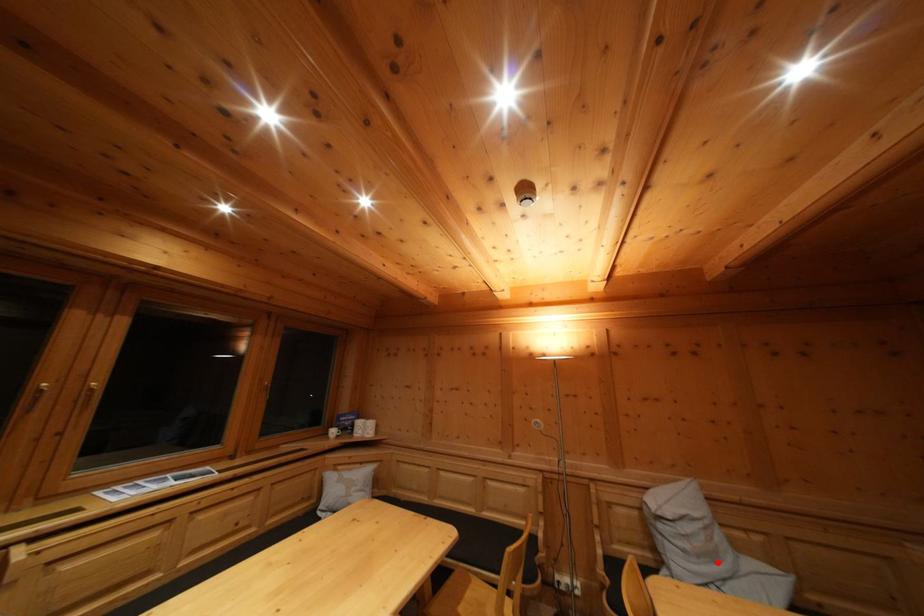
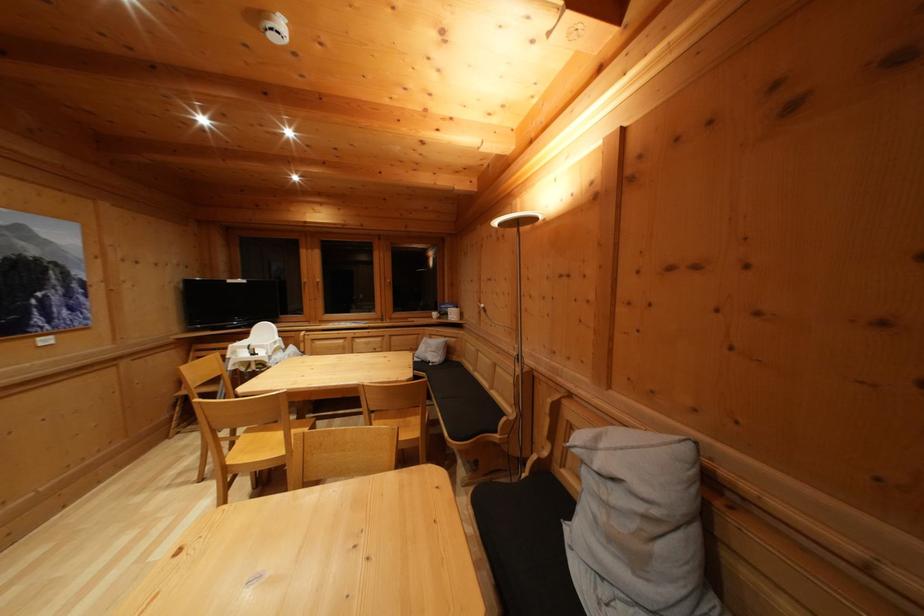
Question: I am providing you with two images of the same scene from different viewpoints. A red point is shown in image1. For the corresponding object point in image2, is it positioned nearer or farther from the camera?

Choices:
 (A) Nearer
 (B) Farther

Answer: (B)